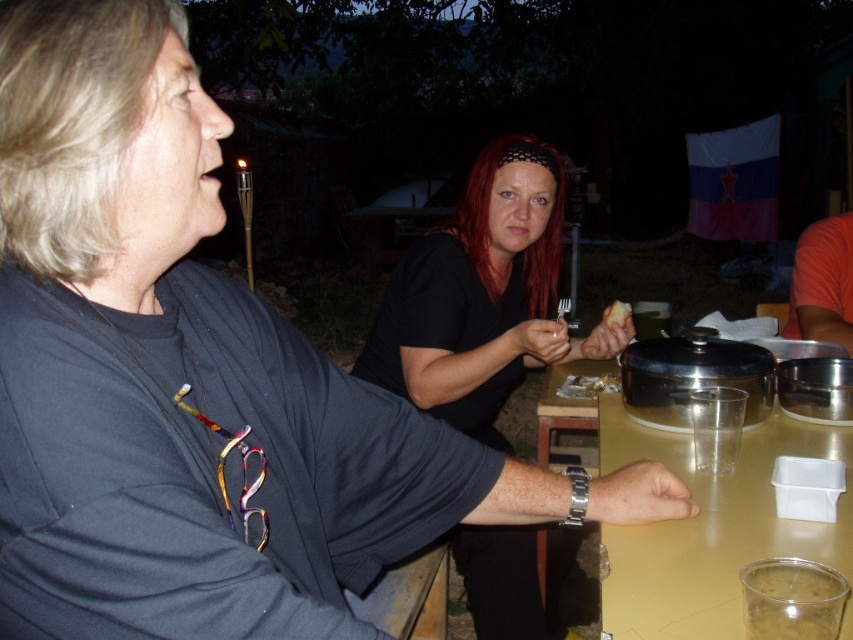
Does point (756, 628) lie in front of point (616, 320)?

Yes, point (756, 628) is in front of point (616, 320).

Looking at this image, between clear plastic cup at lower right and yellow crumbly bread at center, which one is positioned higher?

yellow crumbly bread at center is above.

Where is `clear plastic cup at lower right`? Image resolution: width=853 pixels, height=640 pixels. clear plastic cup at lower right is located at coordinates (791, 600).

Where is `clear plastic cup at lower right`? Image resolution: width=853 pixels, height=640 pixels. clear plastic cup at lower right is located at coordinates (791, 600).

Who is more forward, (815, 246) or (614, 304)?

Positioned in front is point (614, 304).

Who is more distant from viewer, [795,260] or [624,323]?

Point [795,260]

What are the coordinates of `orange t-shirt at right` in the screenshot? It's located at (822, 284).

Based on the photo, which of these two, translucent plastic table at center or clear plastic cup at lower right, stands taller?

With more height is translucent plastic table at center.

Who is positioned more to the left, translucent plastic table at center or clear plastic cup at lower right?

Positioned to the left is clear plastic cup at lower right.

Is point (587, 417) farther from camera compared to point (810, 612)?

Yes, it is.

The height and width of the screenshot is (640, 853). I want to click on translucent plastic table at center, so click(x=698, y=515).